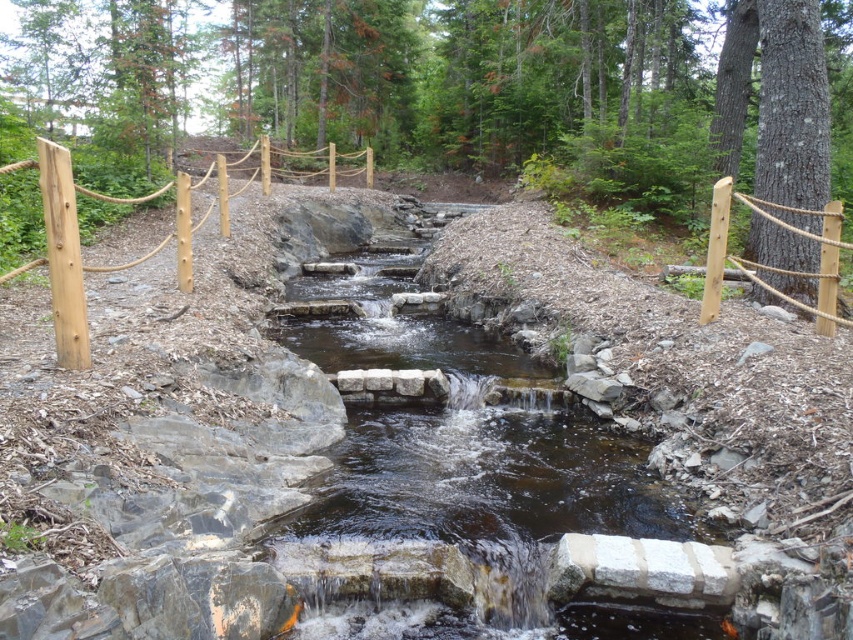
You are standing at the point marked by the coordinates (79,250) in the scene. Looking around, you notice a wooden post at left and the stream with its cascading waterfalls. Which direction should you move to reach the wooden post at left without crossing the stream?

The point marked by the coordinates (79,250) is located on the wooden post at left, so you are already at the wooden post at left and do not need to move further.

You are standing at the edge of the stream and want to place a small decorative rock between the two points, point (36, 266) and point (55, 220). Which point should you place it closer to so that it appears closer to you?

You should place the rock closer to point (36, 266) because it is closer to the viewer than point (55, 220).